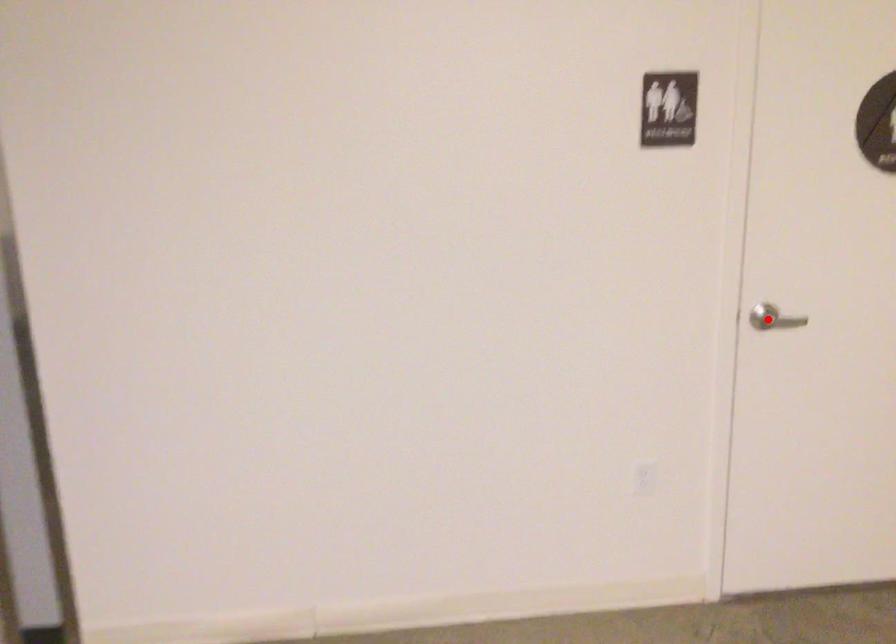
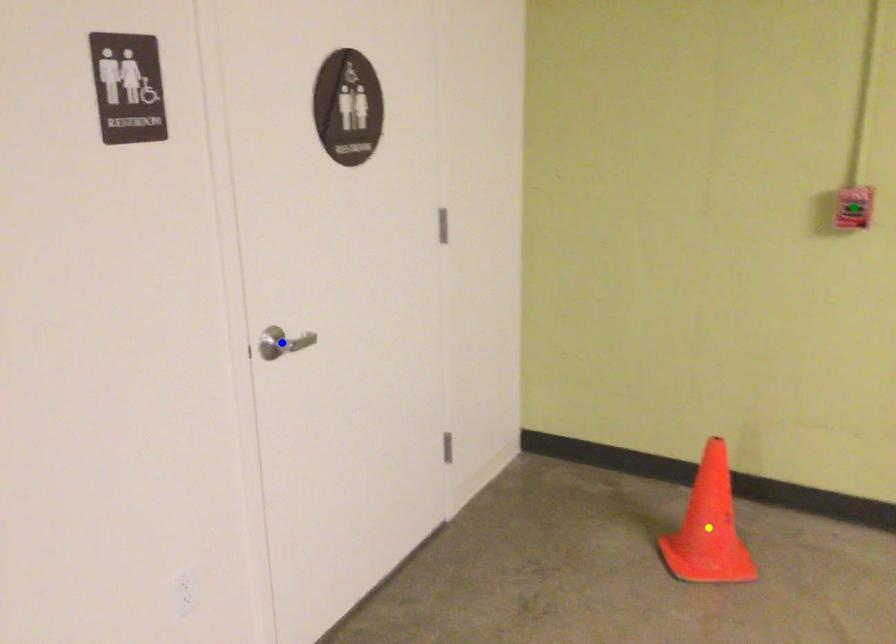
Question: I am providing you with two images of the same scene from different viewpoints. A red point is marked on the first image. You are given multiple points on the second image. Which point in image 2 represents the same 3d spot as the red point in image 1?

Choices:
 (A) green point
 (B) yellow point
 (C) blue point

Answer: (C)